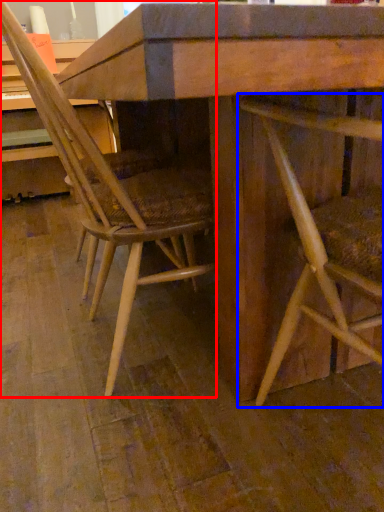
Question: Which of the following is the closest to the observer, chair (highlighted by a red box) or chair (highlighted by a blue box)?

Choices:
 (A) chair
 (B) chair

Answer: (B)